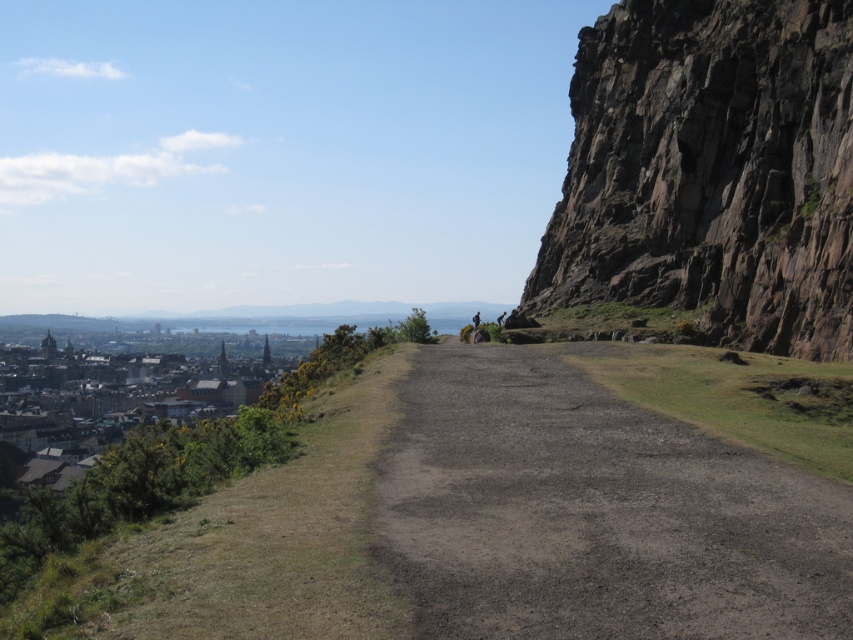
Question: From the image, what is the correct spatial relationship of rugged brown rock at right in relation to stone buildings at lower left?

Choices:
 (A) left
 (B) right

Answer: (B)

Question: Which of the following is the farthest from the observer?

Choices:
 (A) (474, 324)
 (B) (554, 609)
 (C) (634, 52)
 (D) (53, 426)

Answer: (D)

Question: Is dirt/gravel path at center wider than dark brown leather jacket at center?

Choices:
 (A) yes
 (B) no

Answer: (A)

Question: Which point appears closest to the camera in this image?

Choices:
 (A) pos(473,320)
 (B) pos(556,381)

Answer: (B)

Question: Which object appears farthest from the camera in this image?

Choices:
 (A) stone buildings at lower left
 (B) rugged brown rock at right
 (C) dark brown leather jacket at center

Answer: (C)

Question: Can you confirm if rugged brown rock at right is positioned below dark brown leather jacket at center?

Choices:
 (A) no
 (B) yes

Answer: (A)